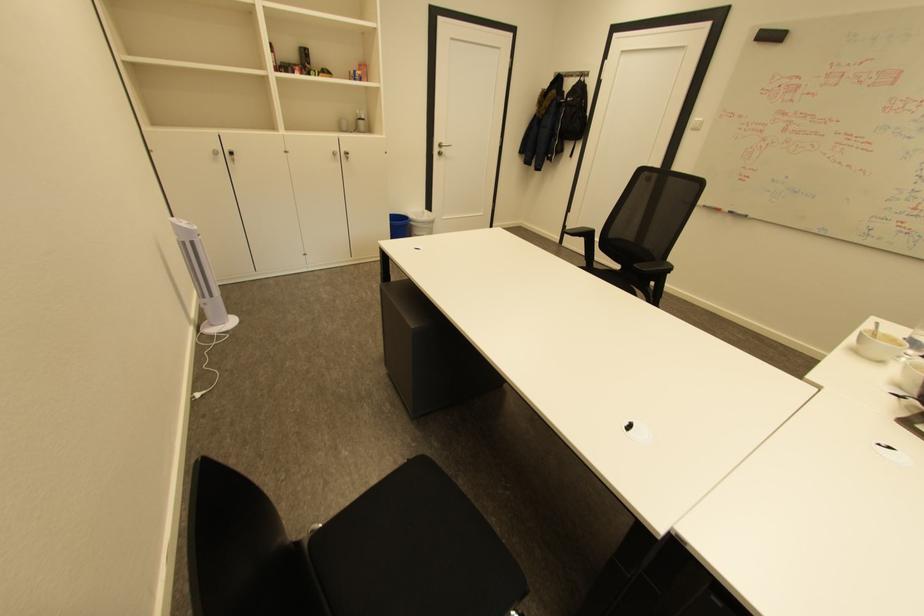
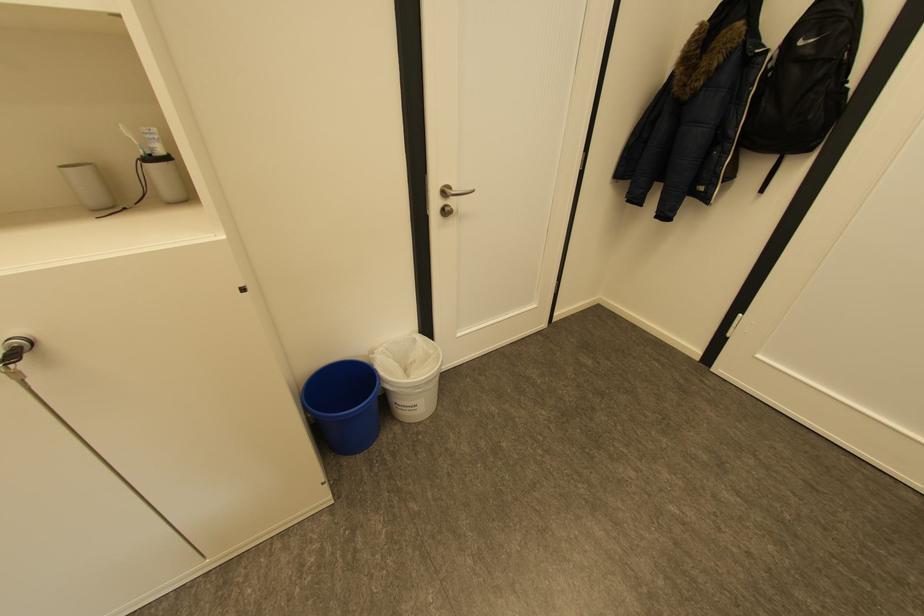
Locate, in the second image, the point that corresponds to [367,119] in the first image.

(157, 159)